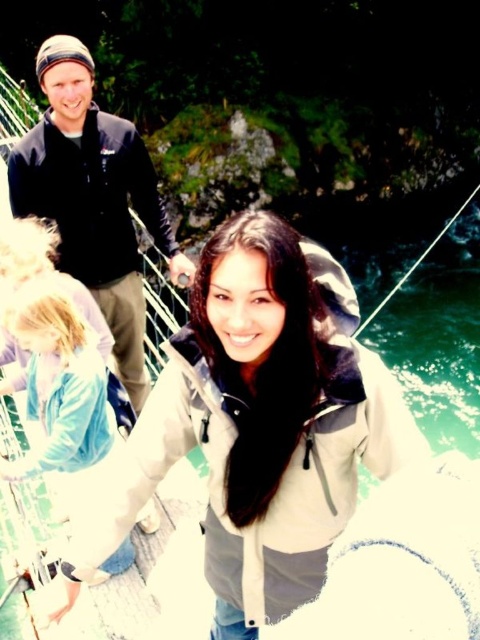
Who is higher up, light gray softshell jacket at center or black matte jacket at upper left?

black matte jacket at upper left is higher up.

How much distance is there between light gray softshell jacket at center and black matte jacket at upper left?

light gray softshell jacket at center is 6.85 meters from black matte jacket at upper left.

Does point (336, 282) lie behind point (84, 282)?

That is False.

Where is `light gray softshell jacket at center`? The height and width of the screenshot is (640, 480). light gray softshell jacket at center is located at coordinates pos(259,426).

Can you confirm if light gray softshell jacket at center is bigger than light blue fabric jacket at lower left?

Correct, light gray softshell jacket at center is larger in size than light blue fabric jacket at lower left.

Based on the photo, between light gray softshell jacket at center and light blue fabric jacket at lower left, which one is positioned lower?

light gray softshell jacket at center

What do you see at coordinates (259, 426) in the screenshot? This screenshot has width=480, height=640. I see `light gray softshell jacket at center` at bounding box center [259, 426].

Where is `light gray softshell jacket at center`? The width and height of the screenshot is (480, 640). light gray softshell jacket at center is located at coordinates (259, 426).

Does black matte jacket at upper left have a lesser width compared to light blue fabric jacket at lower left?

Yes, black matte jacket at upper left is thinner than light blue fabric jacket at lower left.

Between point (19, 168) and point (44, 365), which one is positioned behind?

The point (19, 168) is more distant.

Does point (121, 205) come farther from viewer compared to point (50, 362)?

Yes, point (121, 205) is behind point (50, 362).

This screenshot has width=480, height=640. I want to click on black matte jacket at upper left, so click(94, 198).